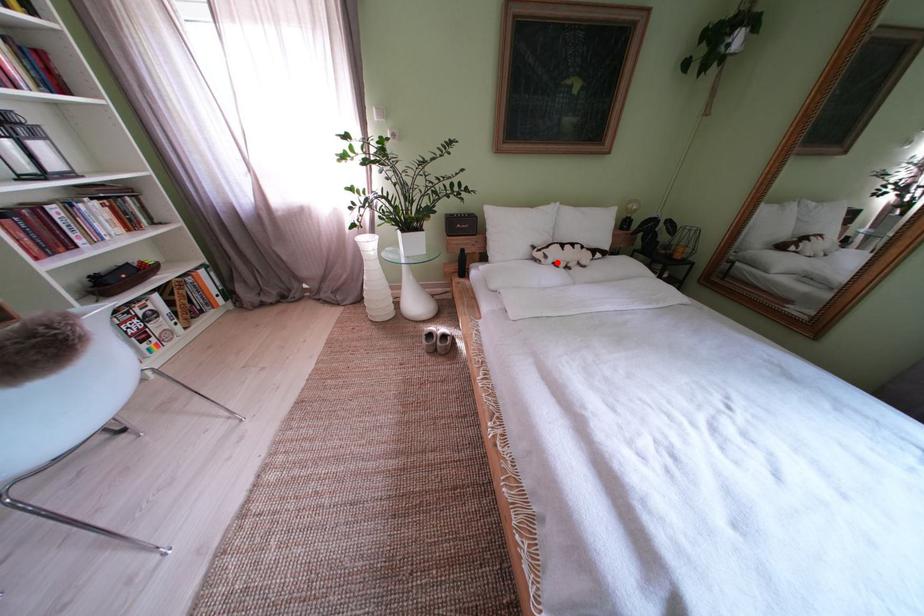
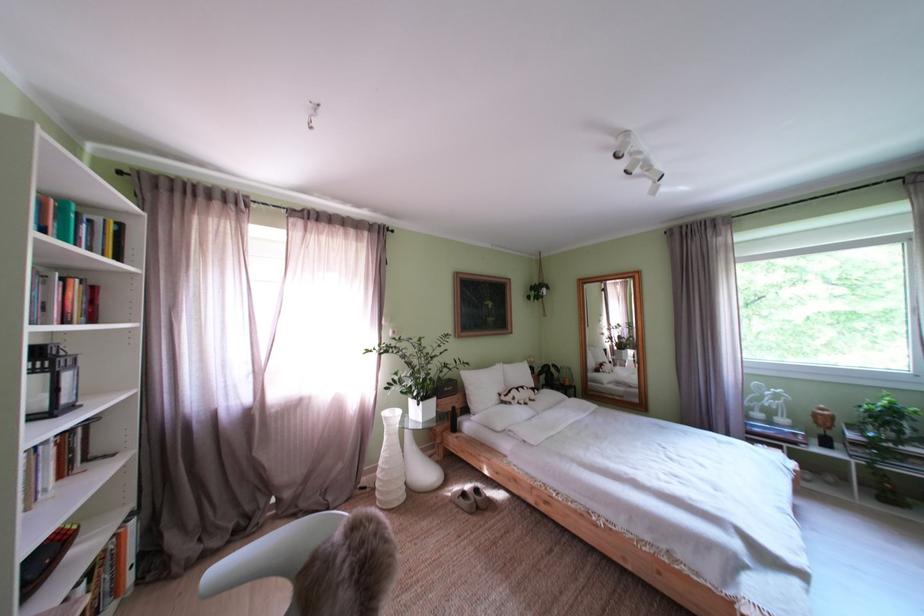
Locate, in the second image, the point that corresponds to the highlighted location in the first image.

(525, 405)